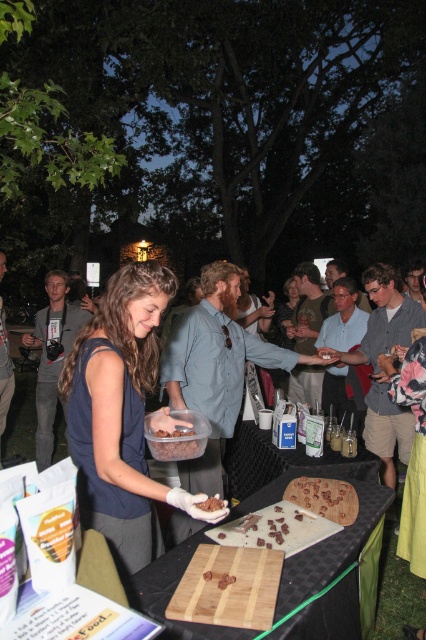
What are the coordinates of the wooden cutting board at center?

The wooden cutting board at center is located at coordinates point (x=331, y=550).

In the scene shown: You are a food taster at the event and need to place a small jar between the wooden cutting board at center and the chocolate cake at center. Which object should you place the jar closer to if you want it to be closer to the taller object?

The wooden cutting board at center is taller than the chocolate cake at center, so you should place the jar closer to the wooden cutting board at center to be near the taller object.